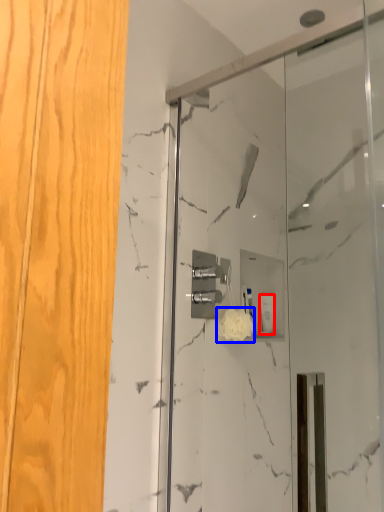
Question: Which object is closer to the camera taking this photo, toiletry (highlighted by a red box) or flower (highlighted by a blue box)?

Choices:
 (A) toiletry
 (B) flower

Answer: (B)